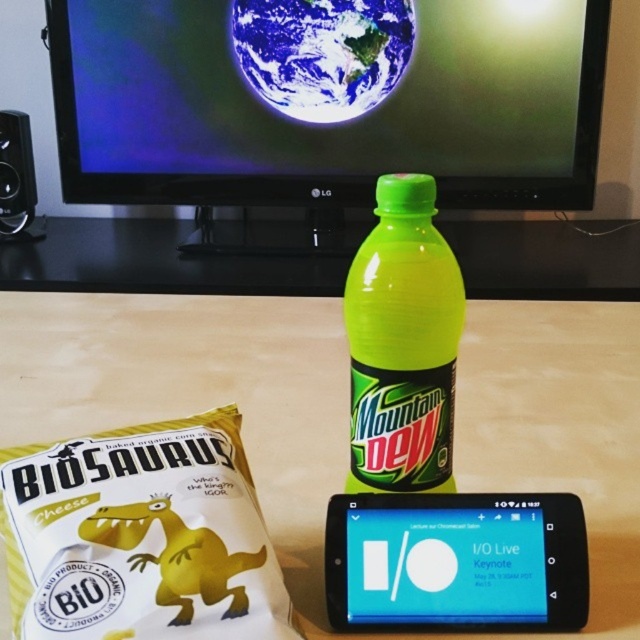
Based on the photo, you are standing in the room and want to place a new item on the matte plastic table at center. Based on the coordinates provided in the Objects Description, where exactly should you position the table?

The matte plastic table at center is located at point coordinates (196, 396), so you should position the new item there.

You are organizing a small party and need to place a 20cm wide cake on the table. Given the space occupied by the black plastic speaker at left, will the matte plastic table at center have enough space to accommodate the cake?

The matte plastic table at center has a larger width than the black plastic speaker at left, so there should be sufficient space to place the 20cm wide cake on the matte plastic table at center.

You are organizing items on the matte plastic table at center and the white matte cheese at lower left. Which object is located more to the left?

The matte plastic table at center is positioned on the left side of white matte cheese at lower left, so the matte plastic table at center is more to the left.